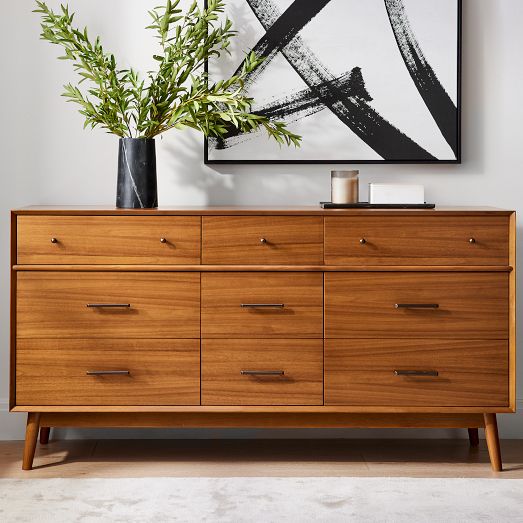
Where is `drawers with long handles`? The width and height of the screenshot is (523, 523). drawers with long handles is located at coordinates (x=145, y=306), (x=146, y=363), (x=229, y=372), (x=236, y=315), (x=359, y=323), (x=375, y=377).